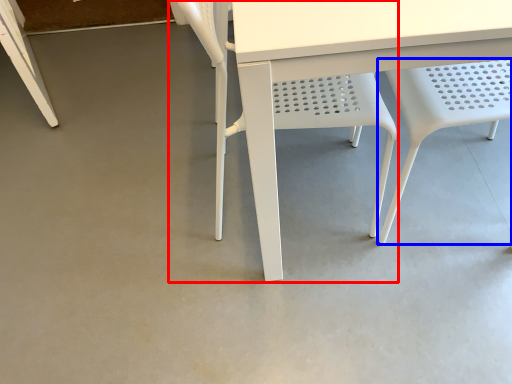
Question: Which object is further to the camera taking this photo, chair (highlighted by a red box) or chair (highlighted by a blue box)?

Choices:
 (A) chair
 (B) chair

Answer: (A)